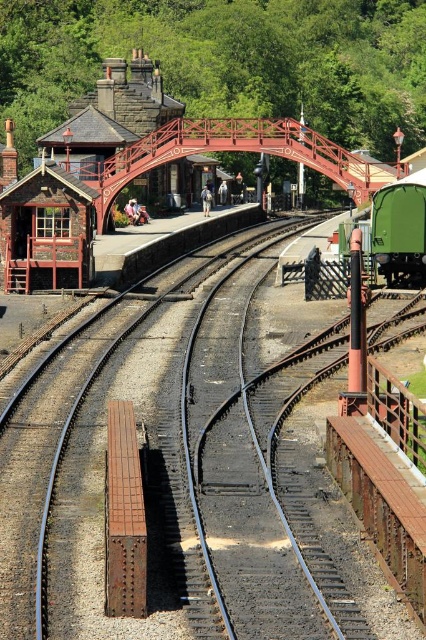
The image size is (426, 640). What are the coordinates of `rusty metal train track at center` in the screenshot? It's located at (186, 461).

Does rusty metal train track at center appear on the left side of green matte train car at center-right?

Yes, rusty metal train track at center is to the left of green matte train car at center-right.

Find the location of a particular element. rusty metal train track at center is located at coordinates (186, 461).